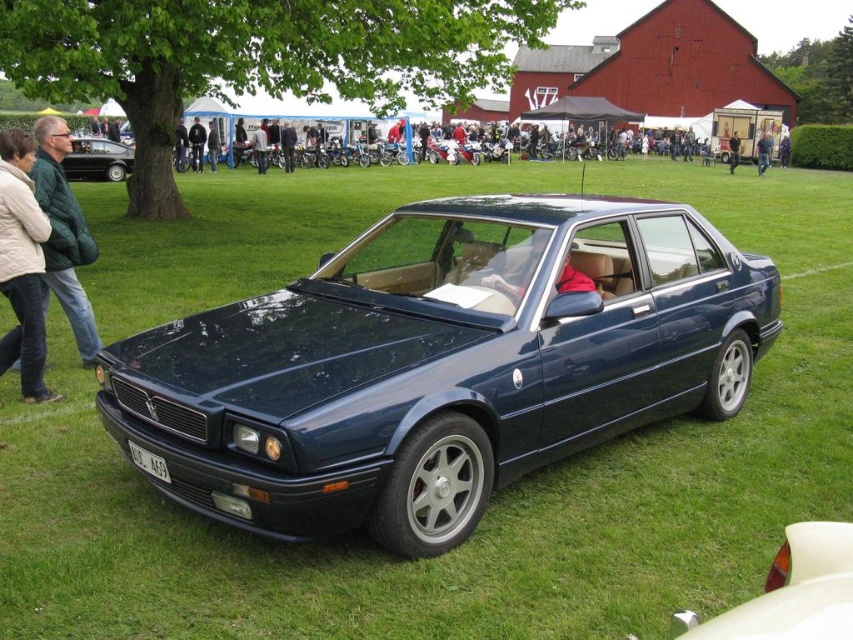
You are a photographer standing at the camera position. You want to capture a closeup shot of the black leather jacket at center. Given that your telephoto lens can focus on objects up to 100 feet away, will you be able to take the closeup without moving closer?

The black leather jacket at center is 93.72 feet away from the camera, which is within the telephoto lens range of up to 100 feet. Therefore, you can take the closeup without moving closer.

You are standing at the center of the grassy field and see the point marked at coordinates (97, 160). What object is located at that point?

The point at coordinates (97, 160) marks the shiny black sedan at left.